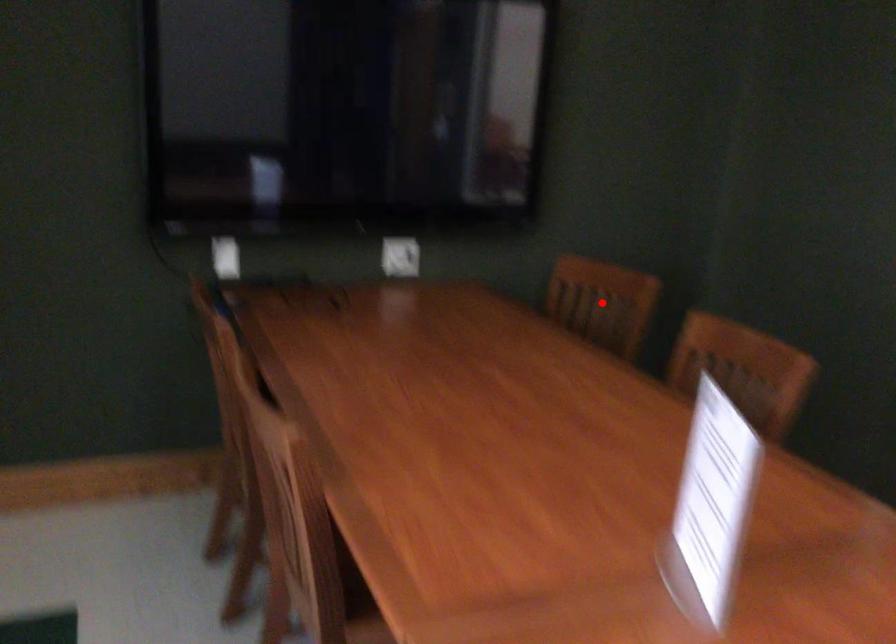
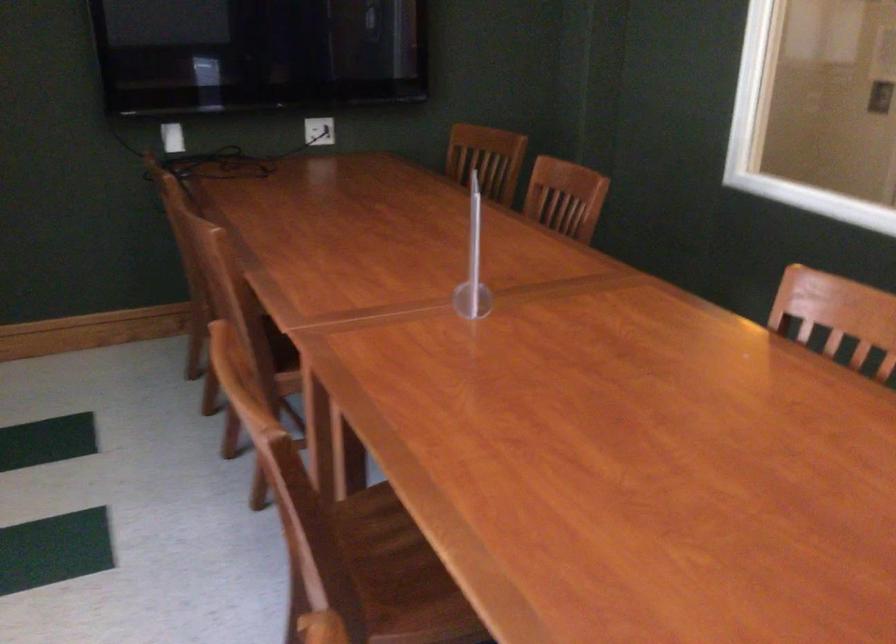
The point at the highlighted location is marked in the first image. Where is the corresponding point in the second image?

(487, 158)